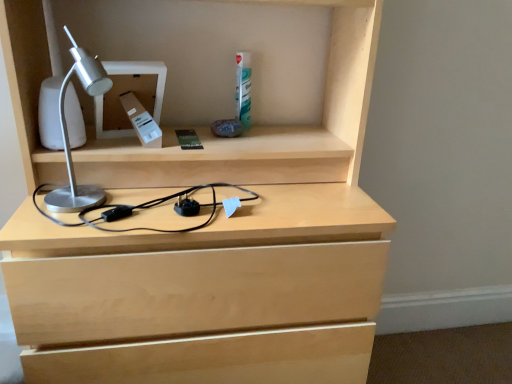
Question: Is silver metallic desk lamp at left taller or shorter than silver metallic desk lamp at upper left?

Choices:
 (A) short
 (B) tall

Answer: (B)

Question: Does point (84, 84) appear closer or farther from the camera than point (140, 61)?

Choices:
 (A) closer
 (B) farther

Answer: (A)

Question: Is silver metallic desk lamp at left bigger or smaller than silver metallic desk lamp at upper left?

Choices:
 (A) big
 (B) small

Answer: (A)

Question: Is silver metallic desk lamp at upper left situated inside silver metallic desk lamp at left or outside?

Choices:
 (A) outside
 (B) inside

Answer: (A)

Question: From the image's perspective, relative to silver metallic desk lamp at left, is silver metallic desk lamp at upper left above or below?

Choices:
 (A) below
 (B) above

Answer: (B)

Question: Is silver metallic desk lamp at upper left bigger or smaller than silver metallic desk lamp at left?

Choices:
 (A) big
 (B) small

Answer: (B)

Question: From a real-world perspective, relative to silver metallic desk lamp at left, is silver metallic desk lamp at upper left vertically above or below?

Choices:
 (A) above
 (B) below

Answer: (A)